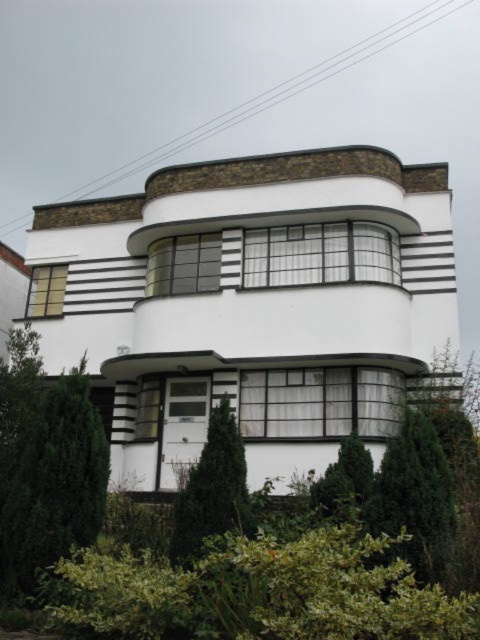
Question: Does green leafy tree at lower left lie behind green leafy bush at center?

Choices:
 (A) no
 (B) yes

Answer: (B)

Question: Can you confirm if green leafy tree at lower left is positioned to the right of green leafy bush at center?

Choices:
 (A) no
 (B) yes

Answer: (A)

Question: Is green leafy tree at lower left positioned in front of green leafy bush at center?

Choices:
 (A) yes
 (B) no

Answer: (B)